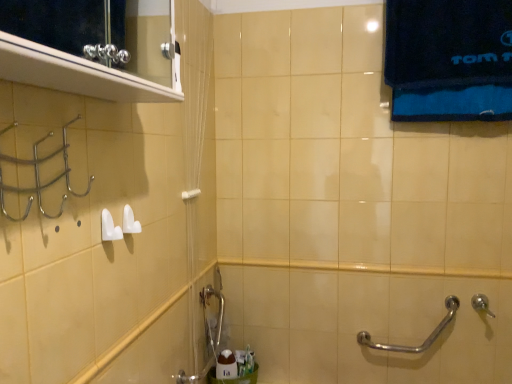
Question: Does brushed metal faucet at lower center have a smaller size compared to silver metallic grab bar at lower right?

Choices:
 (A) no
 (B) yes

Answer: (A)

Question: Is brushed metal faucet at lower center further to camera compared to silver metallic grab bar at lower right?

Choices:
 (A) yes
 (B) no

Answer: (B)

Question: Can you confirm if brushed metal faucet at lower center is bigger than silver metallic grab bar at lower right?

Choices:
 (A) no
 (B) yes

Answer: (B)

Question: Is there a large distance between brushed metal faucet at lower center and silver metallic grab bar at lower right?

Choices:
 (A) yes
 (B) no

Answer: (B)

Question: Is brushed metal faucet at lower center located outside silver metallic grab bar at lower right?

Choices:
 (A) no
 (B) yes

Answer: (B)

Question: Considering the relative sizes of brushed metal faucet at lower center and silver metallic grab bar at lower right in the image provided, is brushed metal faucet at lower center thinner than silver metallic grab bar at lower right?

Choices:
 (A) yes
 (B) no

Answer: (B)

Question: From a real-world perspective, is silver metallic shower at lower right below white plastic towel bar at upper center?

Choices:
 (A) yes
 (B) no

Answer: (A)

Question: Is white plastic towel bar at upper center a part of silver metallic shower at lower right?

Choices:
 (A) no
 (B) yes

Answer: (A)

Question: From the image's perspective, would you say silver metallic shower at lower right is shown under white plastic towel bar at upper center?

Choices:
 (A) no
 (B) yes

Answer: (B)

Question: From the image's perspective, does silver metallic shower at lower right appear higher than white plastic towel bar at upper center?

Choices:
 (A) yes
 (B) no

Answer: (B)

Question: Is silver metallic shower at lower right closer to the viewer compared to white plastic towel bar at upper center?

Choices:
 (A) yes
 (B) no

Answer: (B)

Question: Can you confirm if silver metallic shower at lower right is smaller than white plastic towel bar at upper center?

Choices:
 (A) no
 (B) yes

Answer: (A)

Question: From the image's perspective, is white glossy soap at lower center located above metallic silver medicine cabinet at upper left?

Choices:
 (A) no
 (B) yes

Answer: (A)